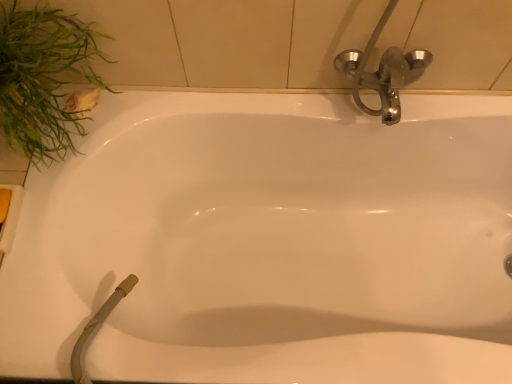
Find the location of a particular element. The height and width of the screenshot is (384, 512). green leafy plant at upper left is located at coordinates (42, 77).

Measure the distance between green leafy plant at upper left and camera.

The distance of green leafy plant at upper left from camera is 32.42 inches.

What do you see at coordinates (42, 77) in the screenshot?
I see `green leafy plant at upper left` at bounding box center [42, 77].

At what (x,y) coordinates should I click in order to perform the action: click on green leafy plant at upper left. Please return your answer as a coordinate pair (x, y). The image size is (512, 384). Looking at the image, I should click on (42, 77).